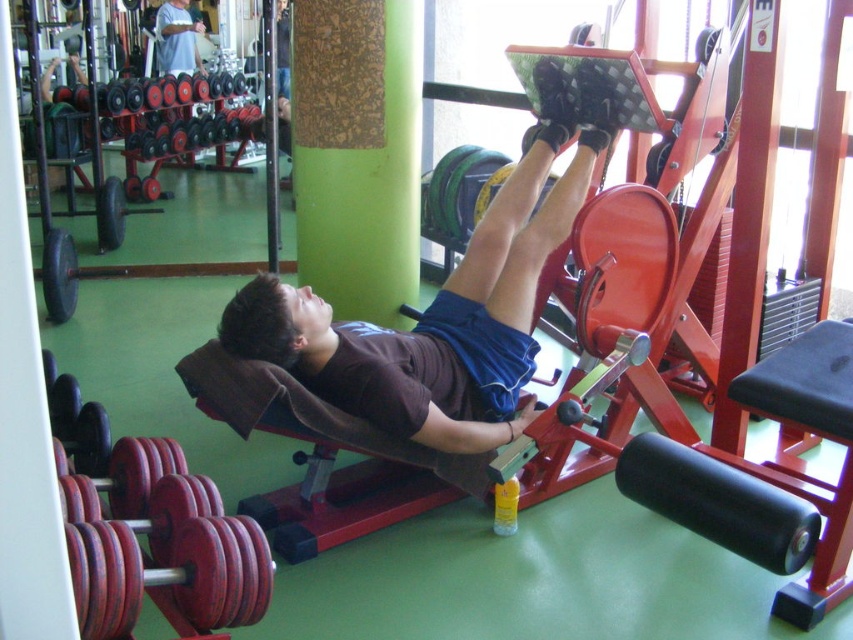
Question: Among these objects, which one is farthest from the camera?

Choices:
 (A) matte black leg press machine at center
 (B) white cotton shirt at upper left
 (C) green cork at center

Answer: (B)

Question: Can you confirm if matte black leg press machine at center is positioned to the right of green cork at center?

Choices:
 (A) no
 (B) yes

Answer: (B)

Question: Which object is closer to the camera taking this photo?

Choices:
 (A) matte black leg press machine at center
 (B) green cork at center
 (C) white cotton shirt at upper left

Answer: (A)

Question: Can you confirm if matte black leg press machine at center is smaller than green cork at center?

Choices:
 (A) yes
 (B) no

Answer: (B)

Question: Is matte black leg press machine at center further to camera compared to white cotton shirt at upper left?

Choices:
 (A) yes
 (B) no

Answer: (B)

Question: Which point appears farthest from the camera in this image?

Choices:
 (A) tap(170, 19)
 (B) tap(346, 52)
 (C) tap(498, 204)

Answer: (A)